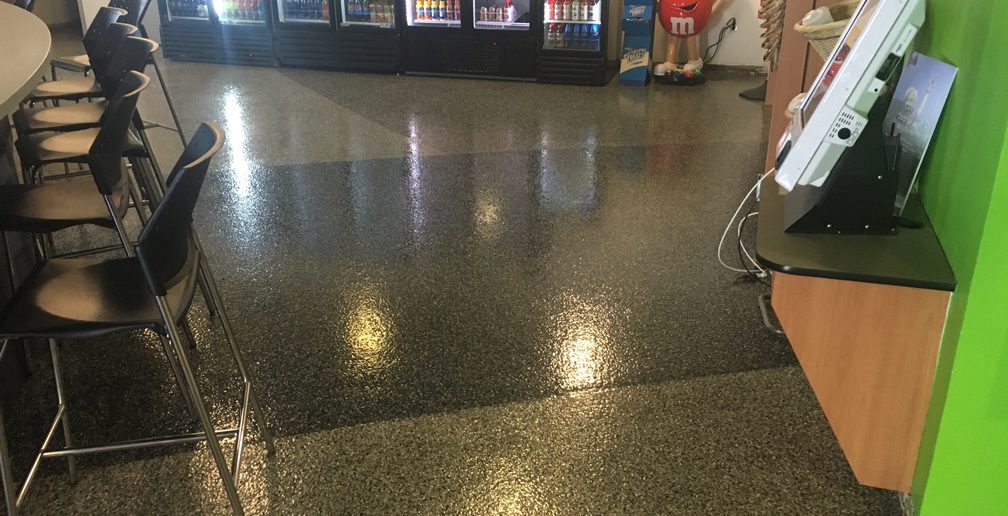
The width and height of the screenshot is (1008, 516). Identify the location of display screen. (843, 43).